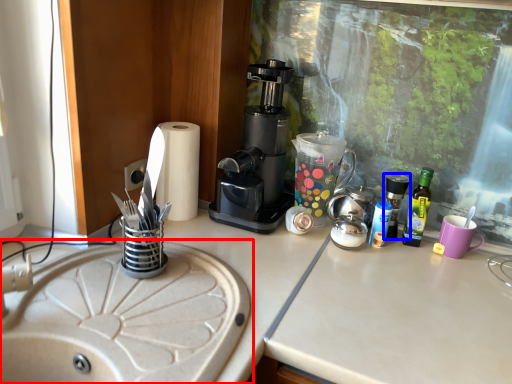
Question: Among these objects, which one is nearest to the camera, sink (highlighted by a red box) or bottle (highlighted by a blue box)?

Choices:
 (A) sink
 (B) bottle

Answer: (A)